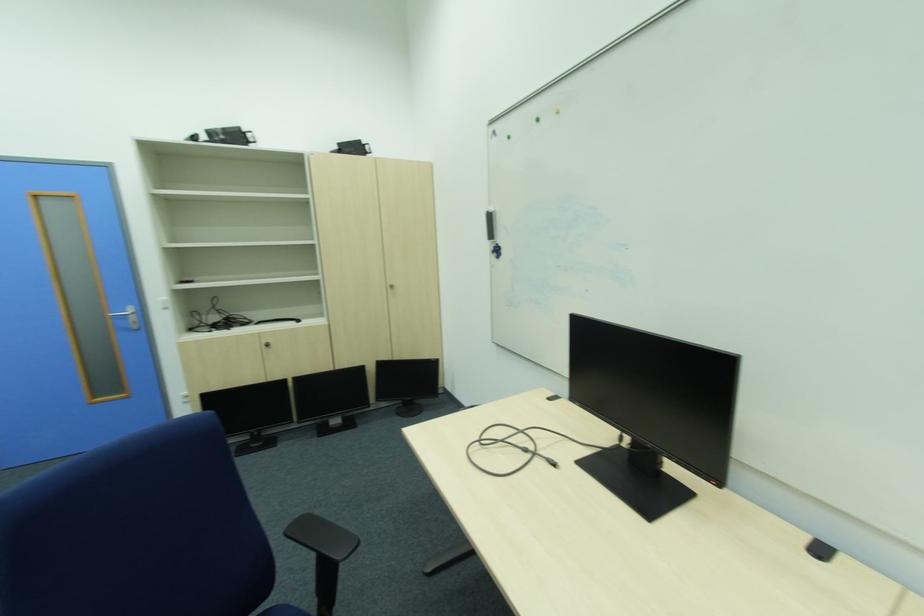
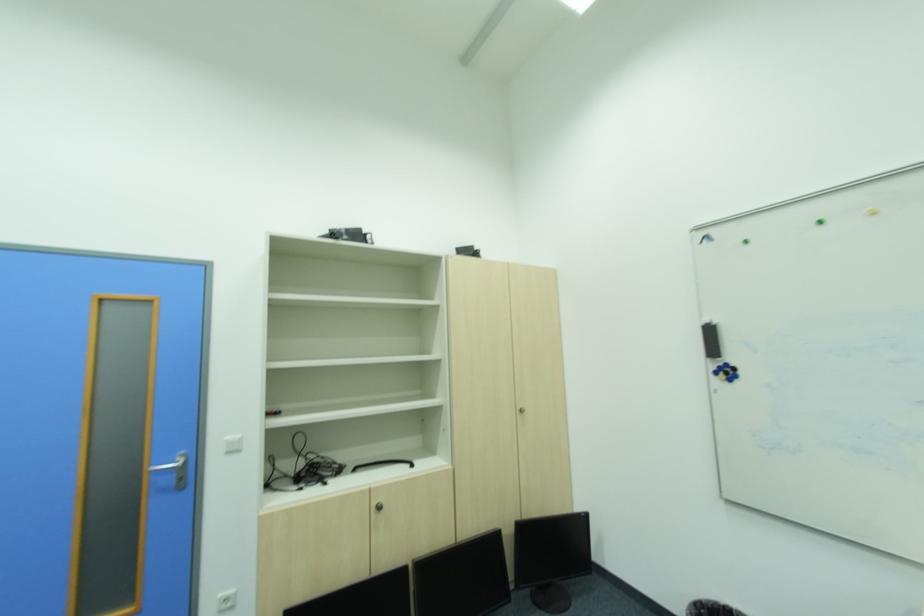
The point at (387, 365) is marked in the first image. Where is the corresponding point in the second image?

(531, 531)